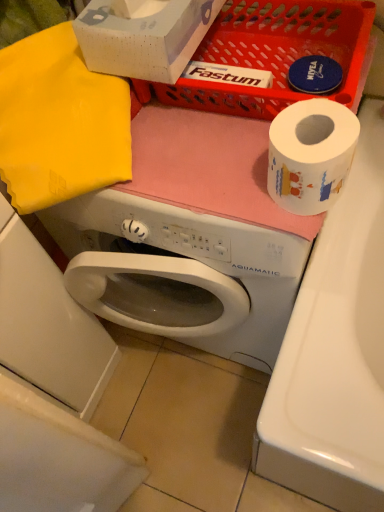
The width and height of the screenshot is (384, 512). Find the location of `free space to the left of white matte toilet paper at upper right`. free space to the left of white matte toilet paper at upper right is located at coordinates (200, 183).